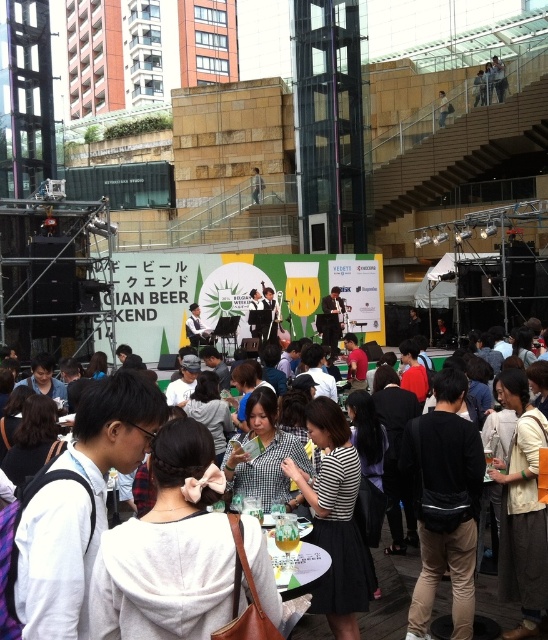
You are at the Belgian Beer Weekend event and need to sit down. There is a light brown wooden chair at center and a light brown leather bag at upper center. Is the chair directly below the bag?

Yes, the light brown wooden chair at center is positioned under the light brown leather bag at upper center, so the chair is directly below the bag.

You are a guest at the Belgian Beer Weekend event and need to sit down. You see a light brown wooden chair at center and a light brown leather bag at upper center. Which object is taller and can you sit on it?

The light brown wooden chair at center is taller than the light brown leather bag at upper center. You can sit on the light brown wooden chair at center since it is a chair designed for sitting.